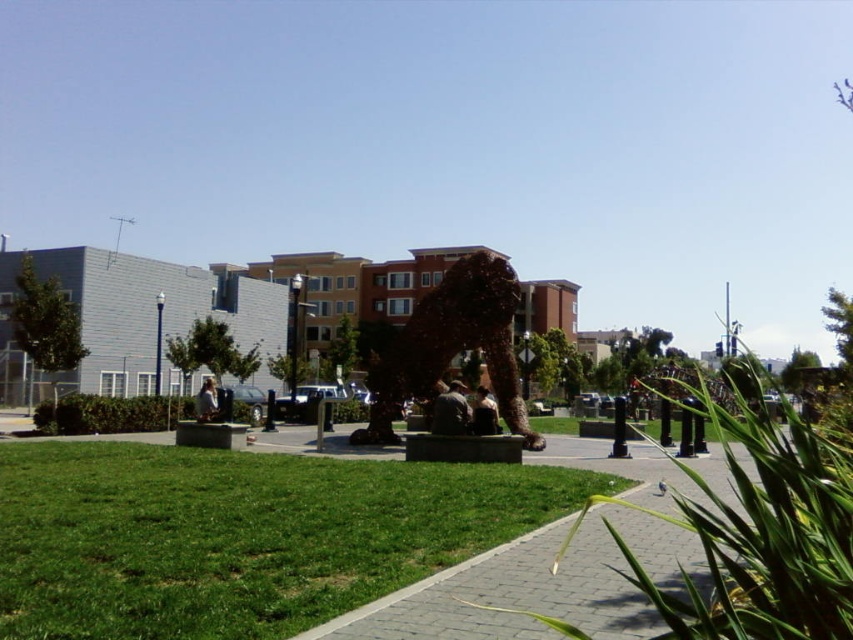
You are a city planner reviewing this public space. You need to install a new bench that must be placed either on the brick paved walkway at center or near the brown textured sculpture at center. Based on their positions, where would be the most logical location for the bench to ensure it is accessible to pedestrians using the walkway?

The brick paved walkway at center is located below the brown textured sculpture at center, so placing the bench on the brick paved walkway at center would ensure it is accessible to pedestrians using the walkway.

You are standing at the point marked as point (534, 586). Which object is directly under your feet?

The brick paved walkway at center is located at point (534, 586), so the object directly under your feet is the brick paved walkway at center.

You are planning to lay a new path in the garden. The green grass at lower left and the brick paved walkway at center are both options. Which surface is narrower?

The green grass at lower left is narrower than the brick paved walkway at center.